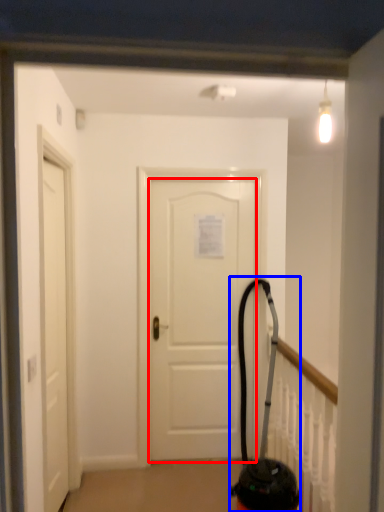
Question: Which point is closer to the camera, door (highlighted by a red box) or extinguisher (highlighted by a blue box)?

Choices:
 (A) door
 (B) extinguisher

Answer: (B)